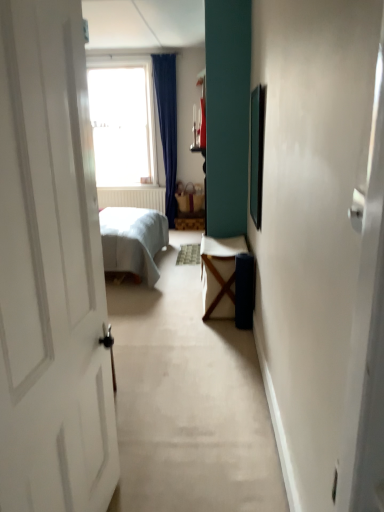
Question: Can you confirm if matte brown wicker basket at center is thinner than transparent glass window at upper center?

Choices:
 (A) yes
 (B) no

Answer: (A)

Question: Considering the relative sizes of matte brown wicker basket at center and transparent glass window at upper center in the image provided, is matte brown wicker basket at center smaller than transparent glass window at upper center?

Choices:
 (A) yes
 (B) no

Answer: (A)

Question: From the image's perspective, is matte brown wicker basket at center above transparent glass window at upper center?

Choices:
 (A) yes
 (B) no

Answer: (B)

Question: Is matte brown wicker basket at center oriented away from transparent glass window at upper center?

Choices:
 (A) yes
 (B) no

Answer: (B)

Question: From a real-world perspective, is matte brown wicker basket at center located higher than transparent glass window at upper center?

Choices:
 (A) no
 (B) yes

Answer: (A)

Question: Based on their positions, is matte brown wicker basket at center located to the left or right of transparent glass window at upper center?

Choices:
 (A) left
 (B) right

Answer: (B)

Question: Is matte brown wicker basket at center inside the boundaries of transparent glass window at upper center, or outside?

Choices:
 (A) outside
 (B) inside

Answer: (A)

Question: Relative to transparent glass window at upper center, is matte brown wicker basket at center in front or behind?

Choices:
 (A) behind
 (B) front

Answer: (A)

Question: Is matte brown wicker basket at center wider or thinner than transparent glass window at upper center?

Choices:
 (A) thin
 (B) wide

Answer: (A)

Question: From a real-world perspective, is wooden table at center positioned above or below matte brown wicker basket at center?

Choices:
 (A) below
 (B) above

Answer: (A)

Question: From the image's perspective, relative to matte brown wicker basket at center, is wooden table at center above or below?

Choices:
 (A) below
 (B) above

Answer: (A)

Question: Relative to matte brown wicker basket at center, is wooden table at center in front or behind?

Choices:
 (A) front
 (B) behind

Answer: (A)

Question: From their relative heights in the image, would you say wooden table at center is taller or shorter than matte brown wicker basket at center?

Choices:
 (A) short
 (B) tall

Answer: (B)

Question: Relative to wooden table at center, is transparent glass window at upper center in front or behind?

Choices:
 (A) front
 (B) behind

Answer: (B)

Question: From a real-world perspective, is transparent glass window at upper center above or below wooden table at center?

Choices:
 (A) below
 (B) above

Answer: (B)